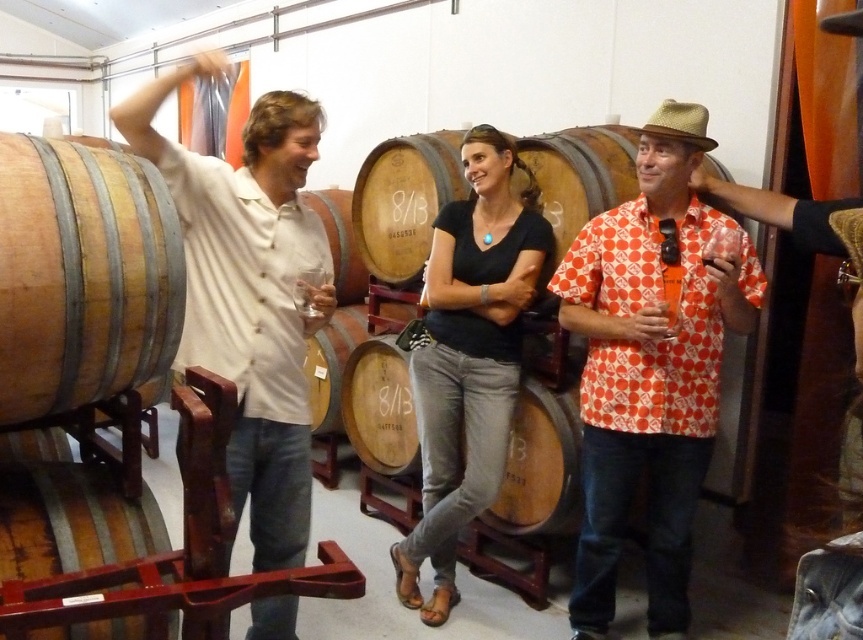
Between light beige shirt at left and wooden barrel at left, which one has more height?

With more height is light beige shirt at left.

Image resolution: width=863 pixels, height=640 pixels. What do you see at coordinates (249, 291) in the screenshot? I see `light beige shirt at left` at bounding box center [249, 291].

You are a GUI agent. You are given a task and a screenshot of the screen. Output one action in this format:
    pyautogui.click(x=<x>, y=<y>)
    Task: Click on the light beige shirt at left
    
    Given the screenshot: What is the action you would take?
    pyautogui.click(x=249, y=291)

In the scene shown: Does orange dotted shirt at center have a larger size compared to black matte shirt at center?

Correct, orange dotted shirt at center is larger in size than black matte shirt at center.

Looking at this image, which is more to the right, orange dotted shirt at center or black matte shirt at center?

Positioned to the right is orange dotted shirt at center.

Does point (591, 285) lie behind point (488, 292)?

That is False.

You are a GUI agent. You are given a task and a screenshot of the screen. Output one action in this format:
    pyautogui.click(x=<x>, y=<y>)
    Task: Click on the orange dotted shirt at center
    The width and height of the screenshot is (863, 640).
    Given the screenshot: What is the action you would take?
    pyautogui.click(x=652, y=365)

Which is more to the left, wooden barrel at left or wooden barrel at lower left?

Positioned to the left is wooden barrel at lower left.

Is point (67, 387) more distant than point (64, 508)?

No, (67, 387) is closer to viewer.

Between point (14, 140) and point (112, 632), which one is positioned behind?

The point (112, 632) is behind.

Find the location of a particular element. wooden barrel at left is located at coordinates (82, 275).